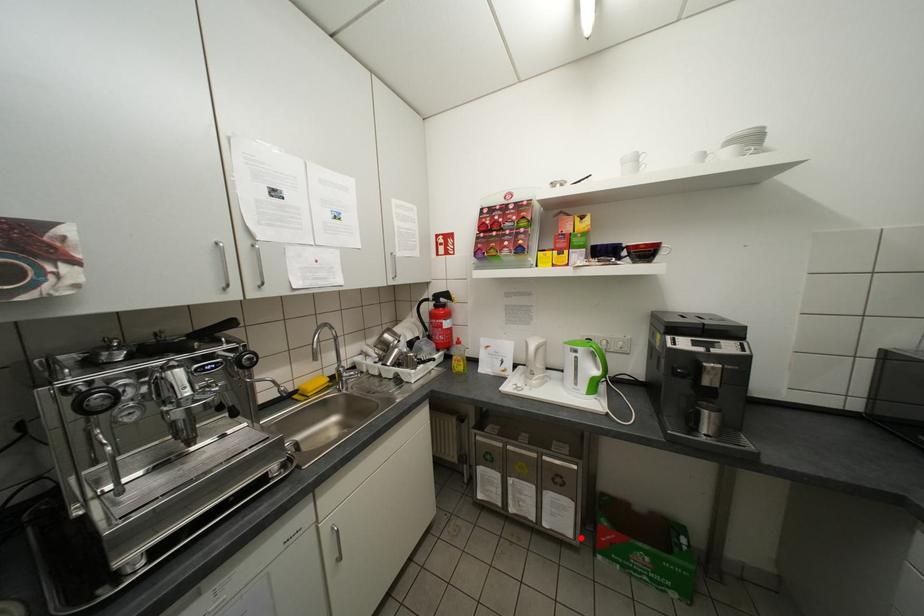
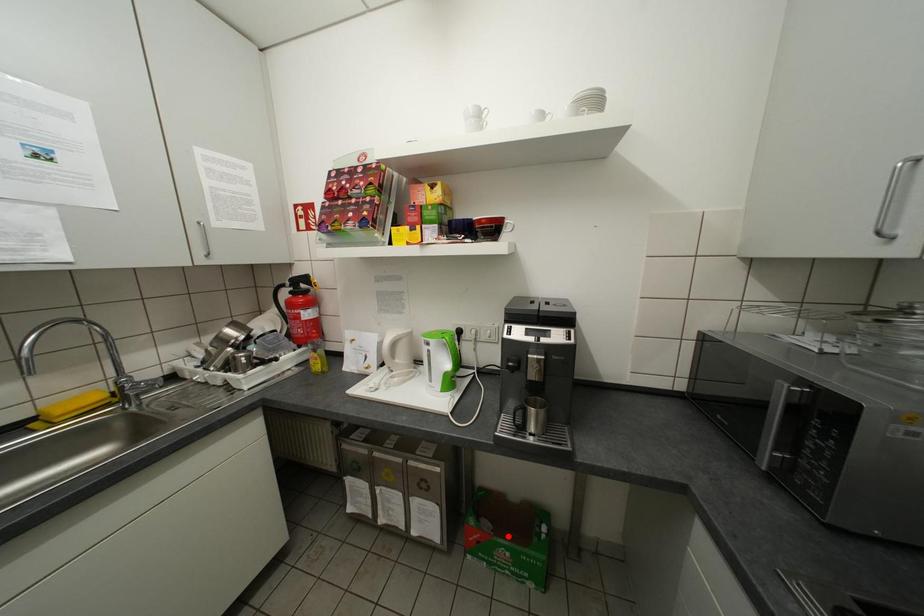
I am providing you with two images of the same scene from different viewpoints. A red point is marked on the first image and another point is marked on the second image. Do the highlighted points in image1 and image2 indicate the same real-world spot?

No